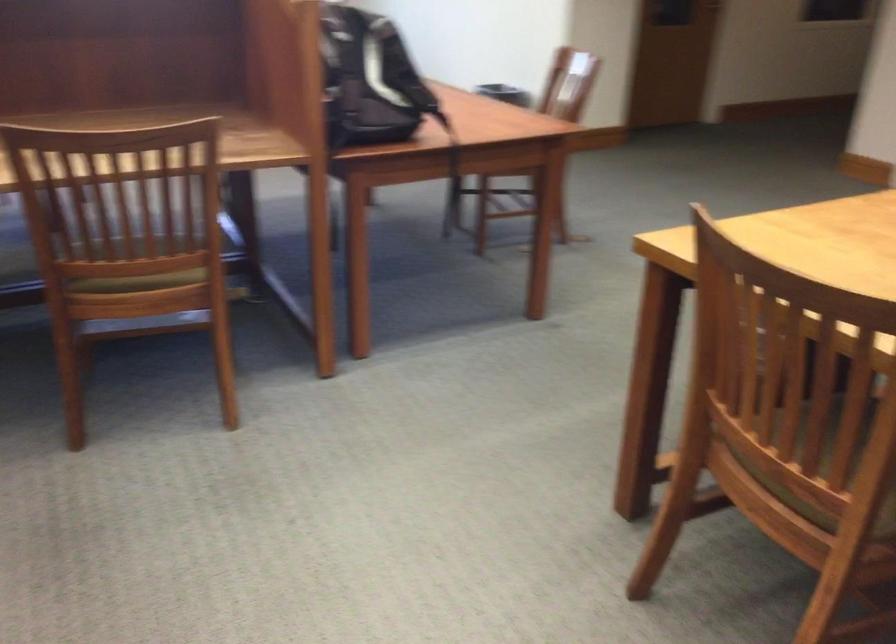
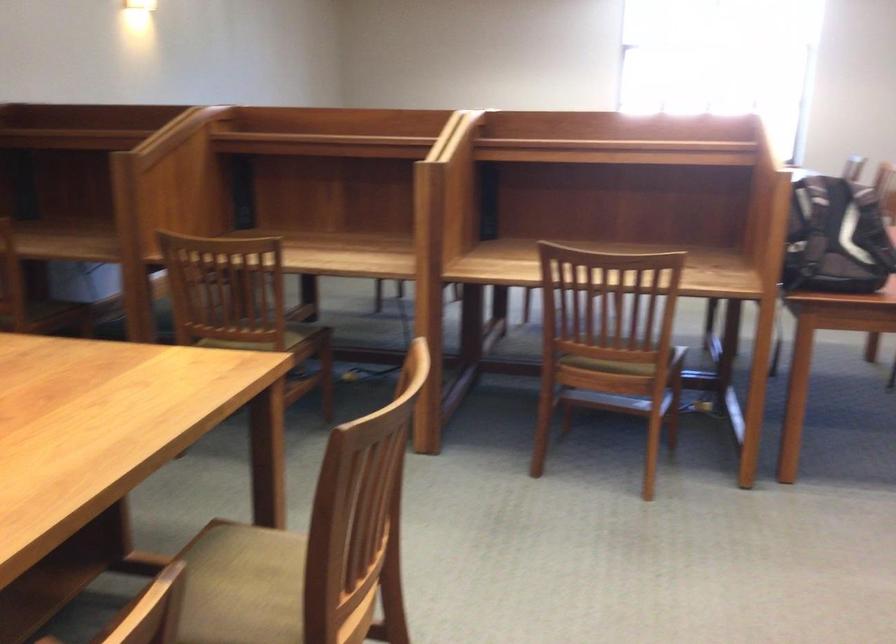
Question: The images are taken continuously from a first-person perspective. In which direction is your viewpoint rotating?

Choices:
 (A) Left
 (B) Right
 (C) Up
 (D) Down

Answer: (A)